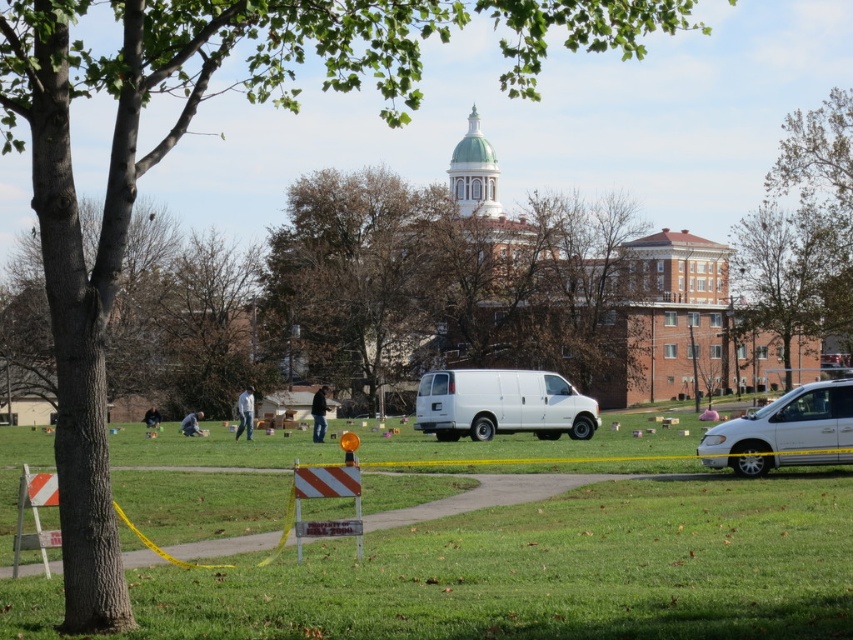
Question: Can you confirm if jeans at center is thinner than black leather jacket at center?

Choices:
 (A) no
 (B) yes

Answer: (A)

Question: Among these points, which one is nearest to the camera?

Choices:
 (A) (442, 394)
 (B) (325, 401)

Answer: (A)

Question: Observing the image, what is the correct spatial positioning of green grass at center in reference to white matte van at lower right?

Choices:
 (A) below
 (B) above

Answer: (A)

Question: Which of the following is the closest to the observer?

Choices:
 (A) green grass at center
 (B) white matte van at center
 (C) black leather jacket at center
 (D) white matte van at lower right

Answer: (A)

Question: Among these points, which one is farthest from the camera?

Choices:
 (A) (585, 416)
 (B) (648, 513)
 (C) (160, 416)

Answer: (C)

Question: Is the position of green grass at center more distant than that of black leather jacket at center?

Choices:
 (A) no
 (B) yes

Answer: (A)